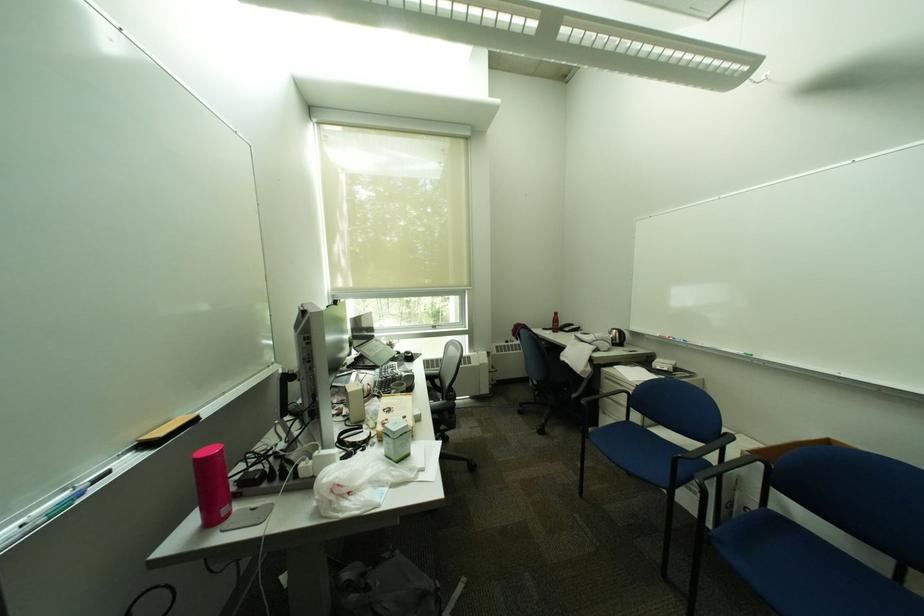
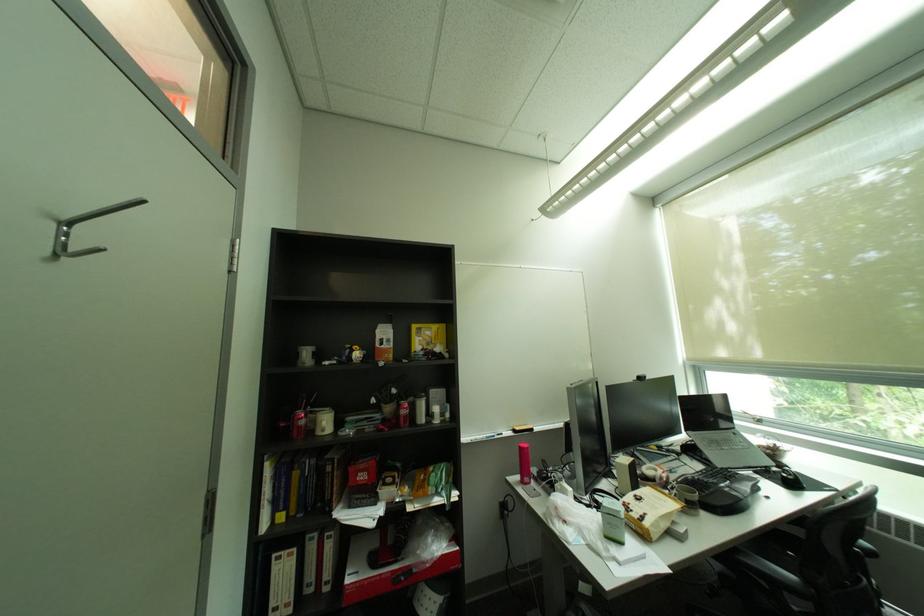
The point at (406, 357) is marked in the first image. Where is the corresponding point in the second image?

(777, 468)